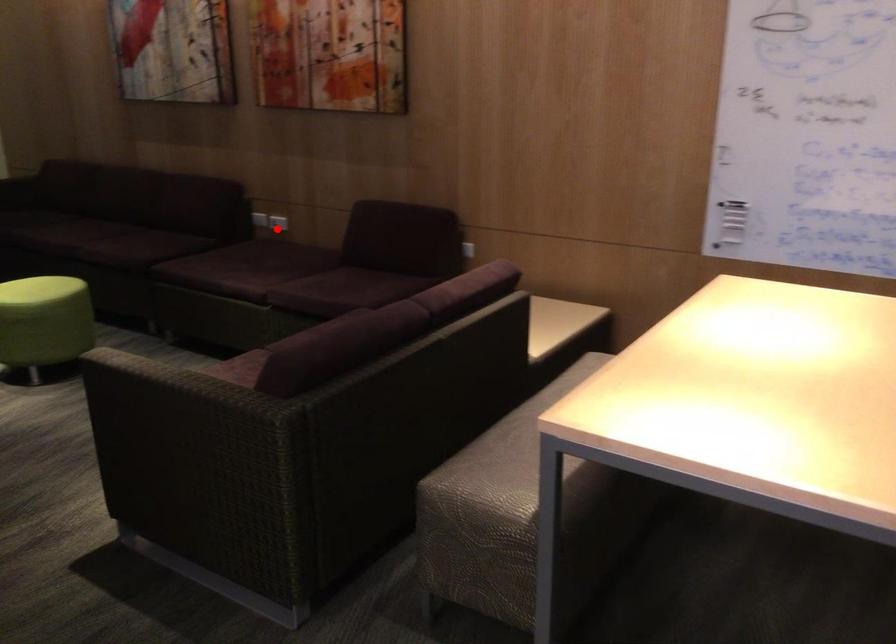
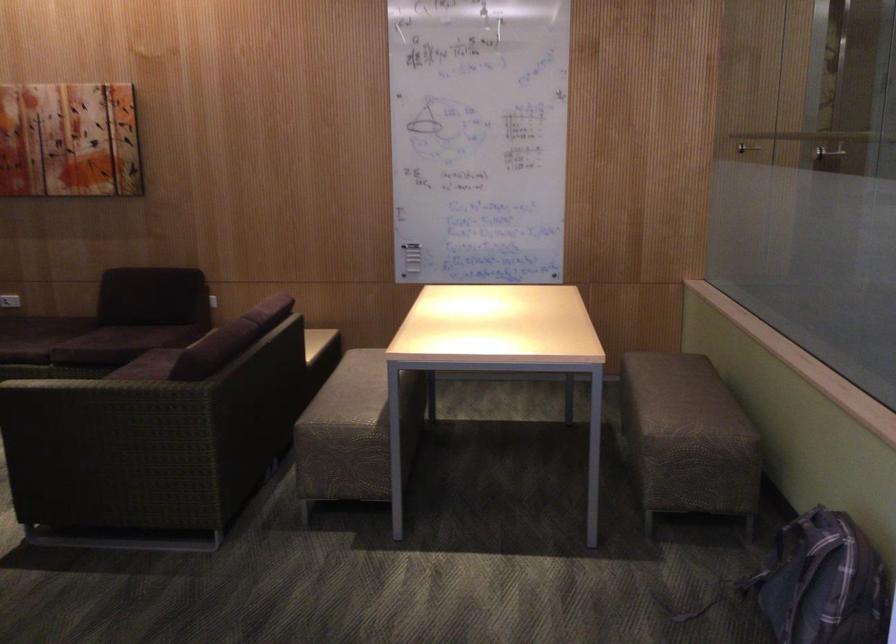
Locate, in the second image, the point that corresponds to the highlighted location in the first image.

(10, 301)